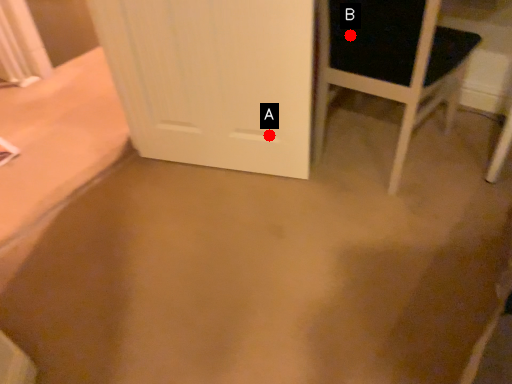
Question: Two points are circled on the image, labeled by A and B beside each circle. Which point appears farthest from the camera in this image?

Choices:
 (A) A is further
 (B) B is further

Answer: (A)